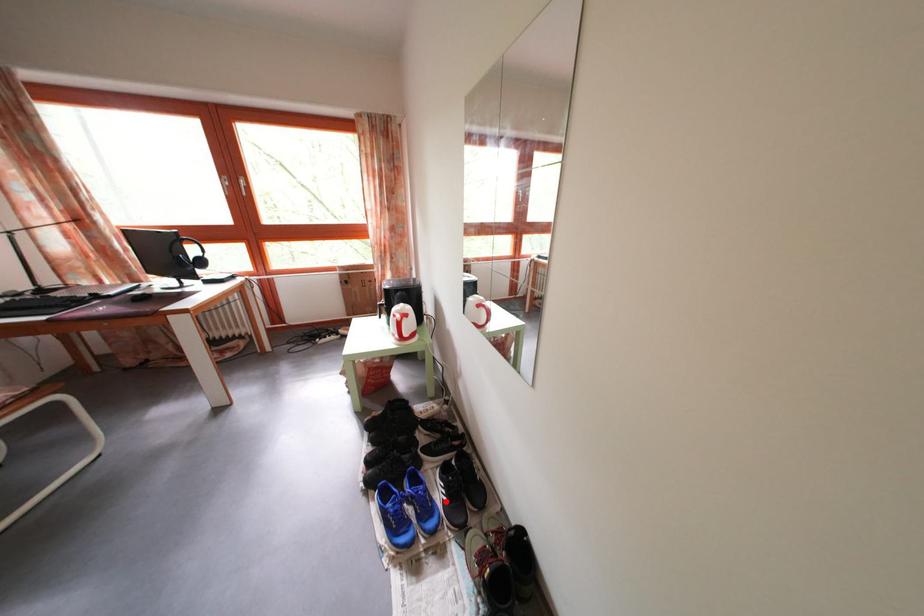
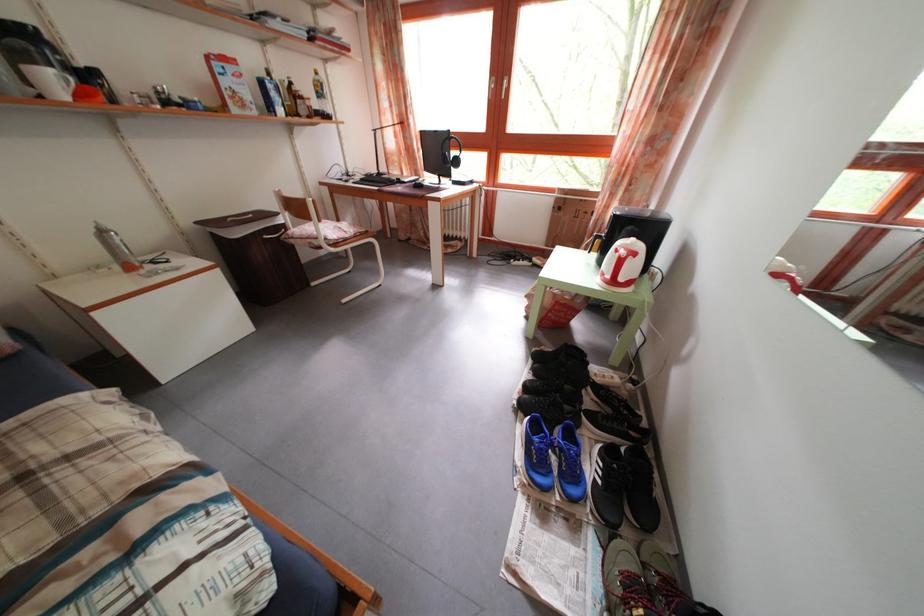
Question: A red point is marked in image1. In image2, is the corresponding 3D point closer to the camera or farther? Reply with the corresponding letter.

Choices:
 (A) The corresponding 3D point is closer.
 (B) The corresponding 3D point is farther.

Answer: (B)